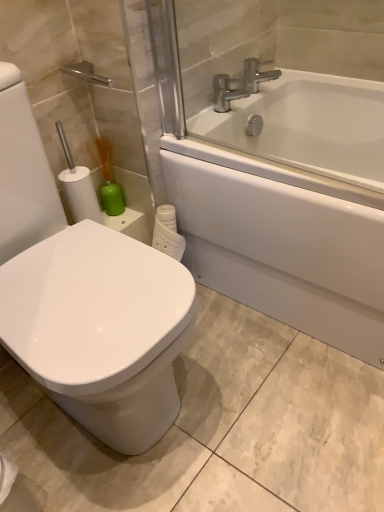
Question: Can you confirm if silver metallic faucet at upper center is positioned to the right of white glossy bidet at left?

Choices:
 (A) yes
 (B) no

Answer: (A)

Question: Is silver metallic faucet at upper center to the left of white glossy bidet at left from the viewer's perspective?

Choices:
 (A) no
 (B) yes

Answer: (A)

Question: Is silver metallic faucet at upper center far away from white glossy bidet at left?

Choices:
 (A) no
 (B) yes

Answer: (A)

Question: Is silver metallic faucet at upper center looking in the opposite direction of white glossy bidet at left?

Choices:
 (A) yes
 (B) no

Answer: (B)

Question: Considering the relative sizes of silver metallic faucet at upper center and white glossy bidet at left in the image provided, is silver metallic faucet at upper center bigger than white glossy bidet at left?

Choices:
 (A) yes
 (B) no

Answer: (B)

Question: Would you say green matte soap dispenser at left is inside or outside silver metallic faucet at upper center?

Choices:
 (A) outside
 (B) inside

Answer: (A)

Question: Is green matte soap dispenser at left wider or thinner than silver metallic faucet at upper center?

Choices:
 (A) wide
 (B) thin

Answer: (B)

Question: From a real-world perspective, is green matte soap dispenser at left above or below silver metallic faucet at upper center?

Choices:
 (A) below
 (B) above

Answer: (A)

Question: In the image, is green matte soap dispenser at left on the left side or the right side of silver metallic faucet at upper center?

Choices:
 (A) left
 (B) right

Answer: (A)

Question: From a real-world perspective, is white glossy bathtub at upper right positioned above or below white glossy bidet at left?

Choices:
 (A) above
 (B) below

Answer: (B)

Question: Is white glossy bathtub at upper right wider or thinner than white glossy bidet at left?

Choices:
 (A) wide
 (B) thin

Answer: (A)

Question: Is white glossy bathtub at upper right bigger or smaller than white glossy bidet at left?

Choices:
 (A) small
 (B) big

Answer: (B)

Question: In terms of height, does white glossy bathtub at upper right look taller or shorter compared to white glossy bidet at left?

Choices:
 (A) short
 (B) tall

Answer: (A)

Question: Is green matte soap dispenser at left taller or shorter than white glossy bathtub at upper right?

Choices:
 (A) short
 (B) tall

Answer: (A)

Question: Is green matte soap dispenser at left in front of or behind white glossy bathtub at upper right in the image?

Choices:
 (A) behind
 (B) front

Answer: (A)